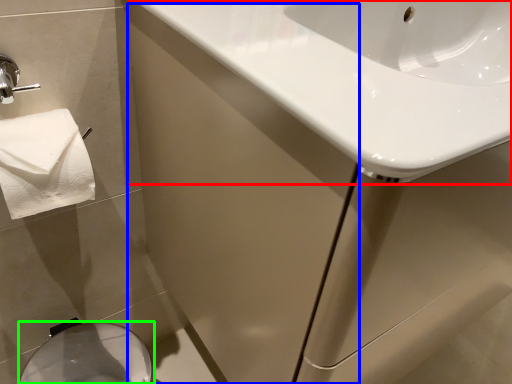
Question: Considering the real-world distances, which object is farthest from sink (highlighted by a red box)? screen door (highlighted by a blue box) or bidet (highlighted by a green box)?

Choices:
 (A) screen door
 (B) bidet

Answer: (B)